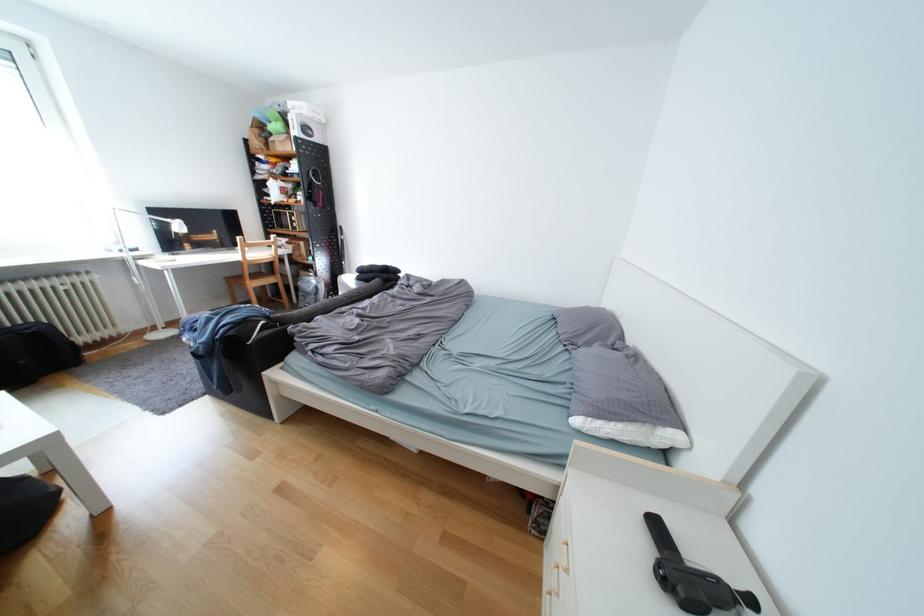
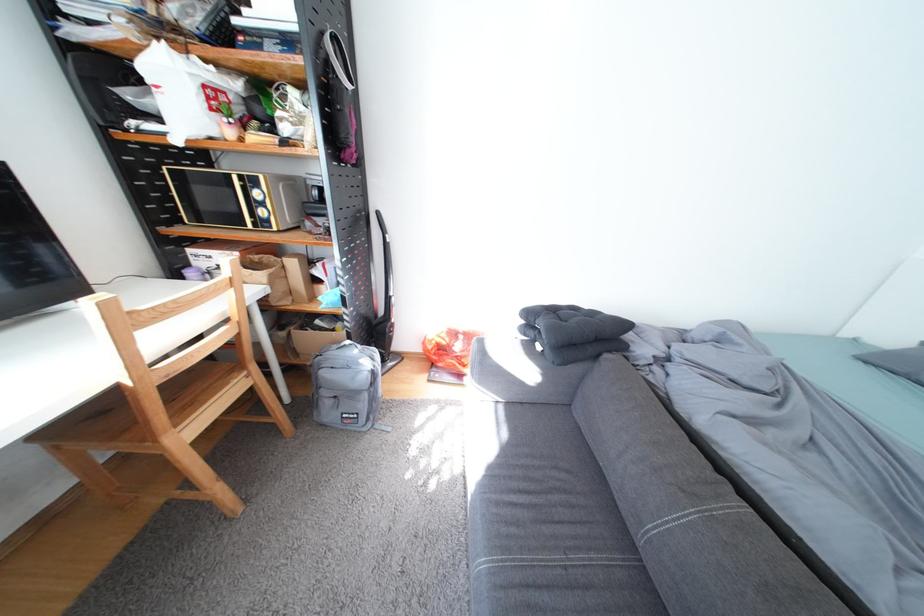
The point at (307, 252) is marked in the first image. Where is the corresponding point in the second image?

(285, 284)